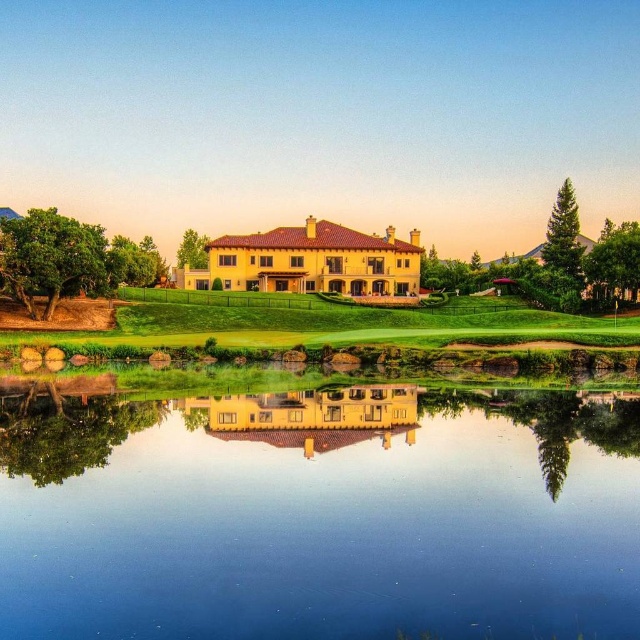
You are standing on the green grass at center and want to see your reflection in the transparent glass water at center. Which direction should you look to see your reflection?

You should look downward because the transparent glass water at center is below green grass at center, so your reflection would be visible in the water beneath you.

You are standing in the middle of the scene and want to place a small decorative stone on the closest surface between the transparent glass water at center and the green grass at center. Which surface should you choose?

The transparent glass water at center is closer to the viewer than the green grass at center, so you should place the decorative stone on the transparent glass water at center.

You are standing in the middle of the scene and want to cross to the other side. You see the transparent glass water at center and the green grass at center. Which one should you step on to avoid getting wet?

You should step on the green grass at center because the transparent glass water at center is much taller than the green grass at center, meaning the water is deeper and more likely to get you wet.